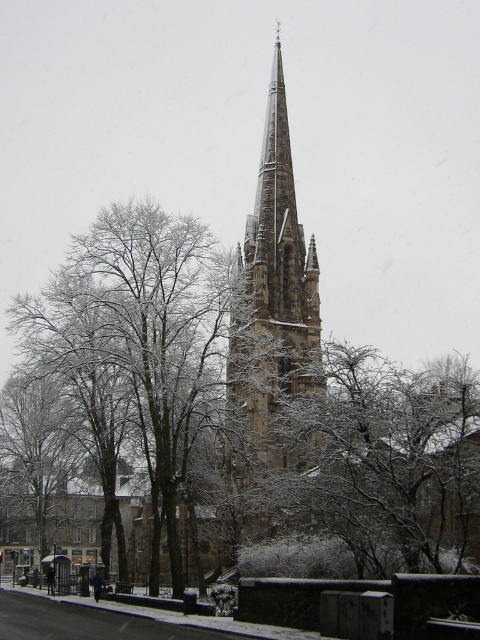
Question: Is snow-covered branches at center further to the viewer compared to brown stone tower at center?

Choices:
 (A) yes
 (B) no

Answer: (B)

Question: From the image, what is the correct spatial relationship of snow-covered tree at center in relation to brown stone tower at center?

Choices:
 (A) above
 (B) below

Answer: (B)

Question: Estimate the real-world distances between objects in this image. Which object is closer to the brown stone tower at center?

Choices:
 (A) snow-covered tree at center
 (B) snow-covered branches at center

Answer: (A)

Question: Observing the image, what is the correct spatial positioning of snow-covered tree at center in reference to brown stone tower at center?

Choices:
 (A) right
 (B) left

Answer: (B)

Question: Which object is the closest to the brown stone tower at center?

Choices:
 (A) snow-covered branches at center
 (B) snow-covered tree at center

Answer: (B)

Question: Which is nearer to the snow-covered tree at center?

Choices:
 (A) brown stone tower at center
 (B) snow-covered branches at center

Answer: (A)